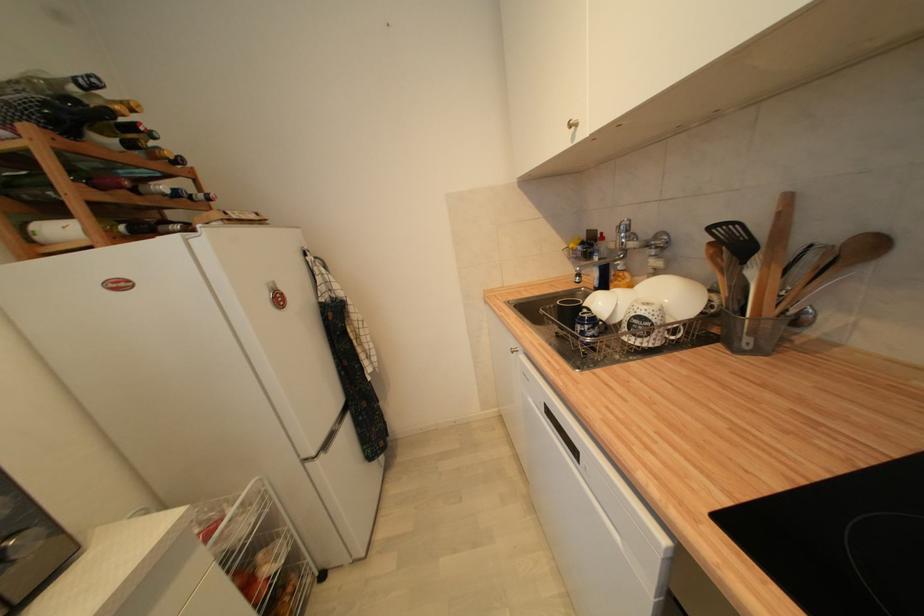
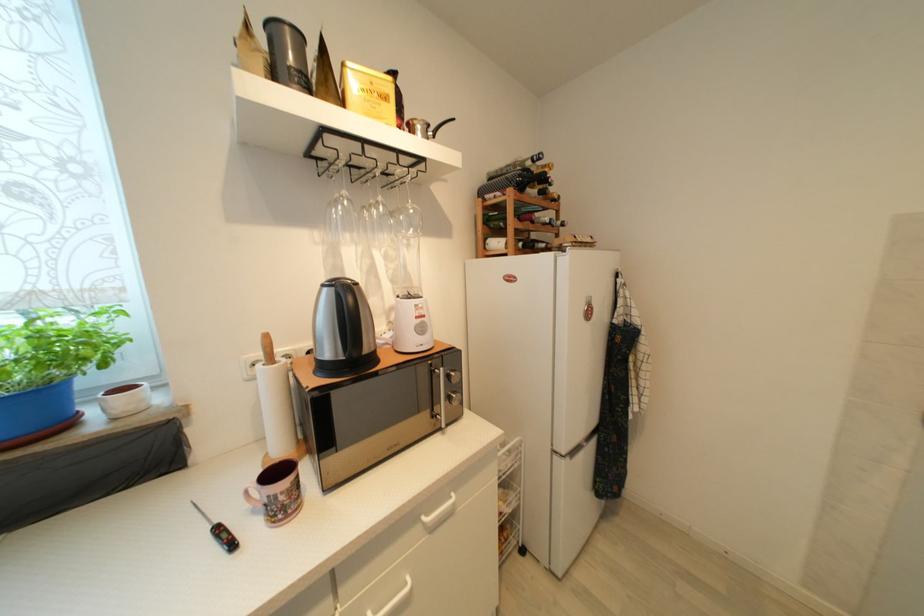
Question: The images are taken continuously from a first-person perspective. In which direction is your viewpoint rotating?

Choices:
 (A) Left
 (B) Right
 (C) Up
 (D) Down

Answer: (A)